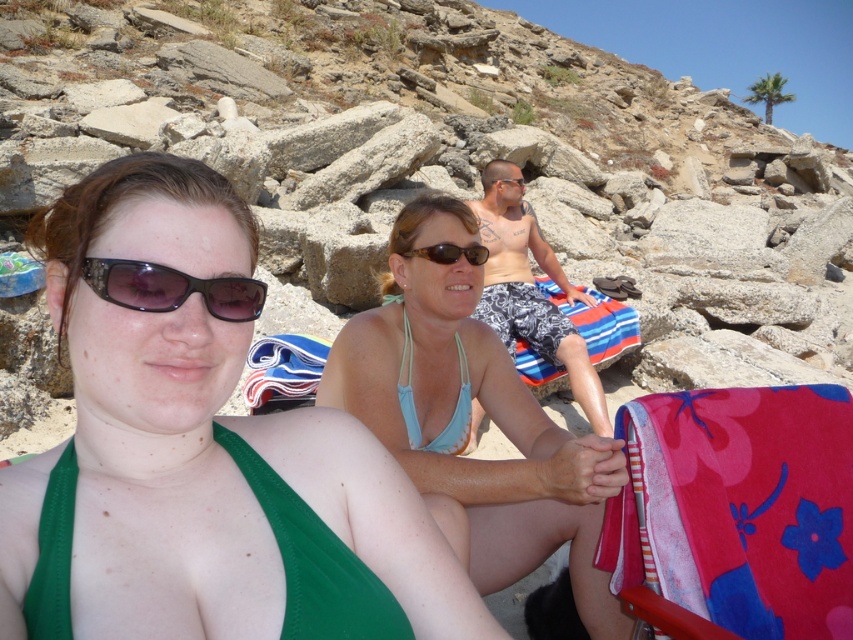
Measure the distance between striped cotton towel at center and camera.

The distance of striped cotton towel at center from camera is 6.25 meters.

Which is in front, point (540, 276) or point (471, 248)?

Point (471, 248) is more forward.

Find the location of a particular element. The width and height of the screenshot is (853, 640). striped cotton towel at center is located at coordinates (596, 323).

Does black textured sunglasses at center appear over brown matte sunglasses at center?

No, black textured sunglasses at center is not above brown matte sunglasses at center.

Does black textured sunglasses at center have a greater width compared to brown matte sunglasses at center?

No.

The width and height of the screenshot is (853, 640). I want to click on black textured sunglasses at center, so click(171, 289).

Does blue fabric bikini top at center appear under brown matte sunglasses at center?

Yes, blue fabric bikini top at center is below brown matte sunglasses at center.

Is blue fabric bikini top at center behind brown matte sunglasses at center?

No, blue fabric bikini top at center is closer to the viewer.

Image resolution: width=853 pixels, height=640 pixels. I want to click on blue fabric bikini top at center, so click(x=469, y=417).